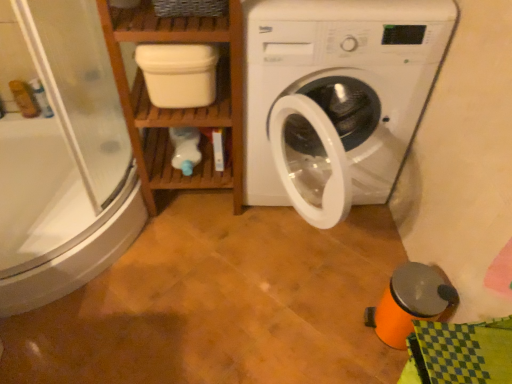
The height and width of the screenshot is (384, 512). In order to click on vacant space in front of wooden shelf at left in this screenshot , I will do `click(195, 252)`.